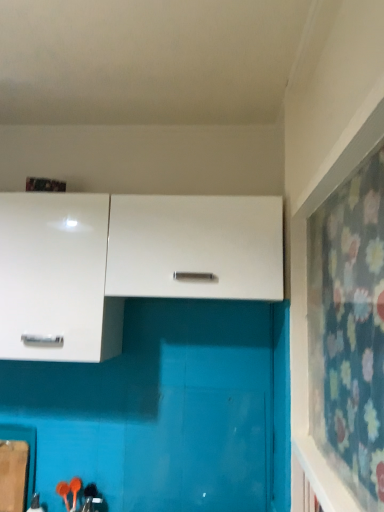
Identify the location of white glossy cabinet at upper left, marked as the second cabinetry in a right-to-left arrangement. The width and height of the screenshot is (384, 512). (56, 279).

Describe the element at coordinates (56, 279) in the screenshot. I see `white glossy cabinet at upper left, marked as the second cabinetry in a right-to-left arrangement` at that location.

Measure the distance between floral fabric curtain at right and camera.

They are 28.84 inches apart.

Identify the location of white matte cabinet at center, acting as the 2th cabinetry starting from the left. The width and height of the screenshot is (384, 512). (195, 247).

Is the position of floral fabric curtain at right more distant than that of white matte cabinet at center, placed as the 1th cabinetry when sorted from right to left?

No, floral fabric curtain at right is closer to the viewer.

Which cabinetry is the 1st one when counting from the back of the floral fabric curtain at right? Please provide its 2D coordinates.

[(195, 247)]

Is floral fabric curtain at right next to white matte cabinet at center, placed as the 1th cabinetry when sorted from right to left, and touching it?

No, floral fabric curtain at right is not next to white matte cabinet at center, placed as the 1th cabinetry when sorted from right to left.

From a real-world perspective, which object rests below the other?

floral fabric curtain at right is physically lower.

Who is more distant, white glossy cabinet at upper left, which is the 1th cabinetry in left-to-right order, or floral fabric curtain at right?

Positioned behind is white glossy cabinet at upper left, which is the 1th cabinetry in left-to-right order.

Between white glossy cabinet at upper left, which is the 1th cabinetry in left-to-right order, and floral fabric curtain at right, which one has more height?

floral fabric curtain at right is taller.

From a real-world perspective, which cabinetry is the 1st one above the floral fabric curtain at right? Please provide its 2D coordinates.

[(56, 279)]

Is white glossy cabinet at upper left, which is the 1th cabinetry in left-to-right order, aimed at floral fabric curtain at right?

No, white glossy cabinet at upper left, which is the 1th cabinetry in left-to-right order, is not aimed at floral fabric curtain at right.

Looking at this image, is floral fabric curtain at right outside of white glossy cabinet at upper left, which is the 1th cabinetry in left-to-right order?

That's correct, floral fabric curtain at right is outside of white glossy cabinet at upper left, which is the 1th cabinetry in left-to-right order.

Locate an element on the screen. This screenshot has height=512, width=384. curtain below the white glossy cabinet at upper left, which is the 1th cabinetry in left-to-right order (from a real-world perspective) is located at coordinates (349, 330).

From a real-world perspective, is floral fabric curtain at right under white glossy cabinet at upper left, which is the 1th cabinetry in left-to-right order?

Correct, in the physical world, floral fabric curtain at right is lower than white glossy cabinet at upper left, which is the 1th cabinetry in left-to-right order.

Which of these two, floral fabric curtain at right or white glossy cabinet at upper left, which is the 1th cabinetry in left-to-right order, stands shorter?

white glossy cabinet at upper left, which is the 1th cabinetry in left-to-right order, is shorter.

From a real-world perspective, is white matte cabinet at center, placed as the 1th cabinetry when sorted from right to left, positioned above or below white glossy cabinet at upper left, marked as the second cabinetry in a right-to-left arrangement?

white matte cabinet at center, placed as the 1th cabinetry when sorted from right to left, is situated higher than white glossy cabinet at upper left, marked as the second cabinetry in a right-to-left arrangement, in the real world.

Is white matte cabinet at center, acting as the 2th cabinetry starting from the left, facing away from white glossy cabinet at upper left, which is the 1th cabinetry in left-to-right order?

white matte cabinet at center, acting as the 2th cabinetry starting from the left, is not turned away from white glossy cabinet at upper left, which is the 1th cabinetry in left-to-right order.

Visually, is white matte cabinet at center, acting as the 2th cabinetry starting from the left, positioned to the left or to the right of white glossy cabinet at upper left, marked as the second cabinetry in a right-to-left arrangement?

In the image, white matte cabinet at center, acting as the 2th cabinetry starting from the left, appears on the right side of white glossy cabinet at upper left, marked as the second cabinetry in a right-to-left arrangement.

Can you confirm if white matte cabinet at center, acting as the 2th cabinetry starting from the left, is bigger than white glossy cabinet at upper left, marked as the second cabinetry in a right-to-left arrangement?

No, white matte cabinet at center, acting as the 2th cabinetry starting from the left, is not bigger than white glossy cabinet at upper left, marked as the second cabinetry in a right-to-left arrangement.

Is white matte cabinet at center, acting as the 2th cabinetry starting from the left, closer to camera compared to floral fabric curtain at right?

No, white matte cabinet at center, acting as the 2th cabinetry starting from the left, is further to the viewer.

Is point (216, 288) closer to viewer compared to point (364, 267)?

That is False.

Considering the relative positions of white matte cabinet at center, placed as the 1th cabinetry when sorted from right to left, and floral fabric curtain at right in the image provided, is white matte cabinet at center, placed as the 1th cabinetry when sorted from right to left, to the right of floral fabric curtain at right from the viewer's perspective?

No.

Find the location of `curtain that appears on the right of white matte cabinet at center, placed as the 1th cabinetry when sorted from right to left`. curtain that appears on the right of white matte cabinet at center, placed as the 1th cabinetry when sorted from right to left is located at coordinates (349, 330).

Between white glossy cabinet at upper left, which is the 1th cabinetry in left-to-right order, and white matte cabinet at center, acting as the 2th cabinetry starting from the left, which one has smaller size?

white matte cabinet at center, acting as the 2th cabinetry starting from the left.

Which of these two, white glossy cabinet at upper left, which is the 1th cabinetry in left-to-right order, or white matte cabinet at center, acting as the 2th cabinetry starting from the left, is thinner?

Thinner between the two is white matte cabinet at center, acting as the 2th cabinetry starting from the left.

From the image's perspective, between white glossy cabinet at upper left, which is the 1th cabinetry in left-to-right order, and white matte cabinet at center, acting as the 2th cabinetry starting from the left, which one is located above?

white matte cabinet at center, acting as the 2th cabinetry starting from the left, from the image's perspective.

You are a GUI agent. You are given a task and a screenshot of the screen. Output one action in this format:
    pyautogui.click(x=<x>, y=<y>)
    Task: Click on the 1st cabinetry behind the floral fabric curtain at right, starting your count from the anchor
    The height and width of the screenshot is (512, 384).
    Given the screenshot: What is the action you would take?
    pyautogui.click(x=195, y=247)

The image size is (384, 512). I want to click on the 1st cabinetry above when counting from the floral fabric curtain at right (from the image's perspective), so click(56, 279).

Based on their spatial positions, is white matte cabinet at center, placed as the 1th cabinetry when sorted from right to left, or floral fabric curtain at right further from white glossy cabinet at upper left, marked as the second cabinetry in a right-to-left arrangement?

floral fabric curtain at right.

Considering their positions, is white matte cabinet at center, acting as the 2th cabinetry starting from the left, positioned further to floral fabric curtain at right than white glossy cabinet at upper left, which is the 1th cabinetry in left-to-right order?

white glossy cabinet at upper left, which is the 1th cabinetry in left-to-right order, lies further to floral fabric curtain at right than the other object.

Estimate the real-world distances between objects in this image. Which object is further from floral fabric curtain at right, white glossy cabinet at upper left, marked as the second cabinetry in a right-to-left arrangement, or white matte cabinet at center, placed as the 1th cabinetry when sorted from right to left?

The object further to floral fabric curtain at right is white glossy cabinet at upper left, marked as the second cabinetry in a right-to-left arrangement.

Based on their spatial positions, is white glossy cabinet at upper left, marked as the second cabinetry in a right-to-left arrangement, or floral fabric curtain at right further from white matte cabinet at center, placed as the 1th cabinetry when sorted from right to left?

The object further to white matte cabinet at center, placed as the 1th cabinetry when sorted from right to left, is floral fabric curtain at right.

From the image, which object appears to be farther from white glossy cabinet at upper left, which is the 1th cabinetry in left-to-right order, floral fabric curtain at right or white matte cabinet at center, placed as the 1th cabinetry when sorted from right to left?

The object further to white glossy cabinet at upper left, which is the 1th cabinetry in left-to-right order, is floral fabric curtain at right.

From the picture: Considering their positions, is floral fabric curtain at right positioned further to white matte cabinet at center, acting as the 2th cabinetry starting from the left, than white glossy cabinet at upper left, which is the 1th cabinetry in left-to-right order?

floral fabric curtain at right.

Locate an element on the screen. The width and height of the screenshot is (384, 512). cabinetry between white glossy cabinet at upper left, marked as the second cabinetry in a right-to-left arrangement, and floral fabric curtain at right is located at coordinates (195, 247).